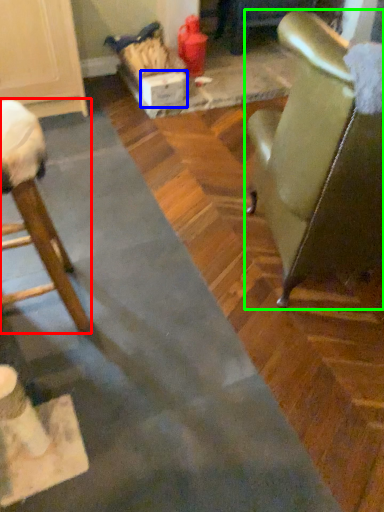
Question: Which is nearer to the chair (highlighted by a red box)? cardboard box (highlighted by a blue box) or chair (highlighted by a green box).

Choices:
 (A) cardboard box
 (B) chair

Answer: (B)